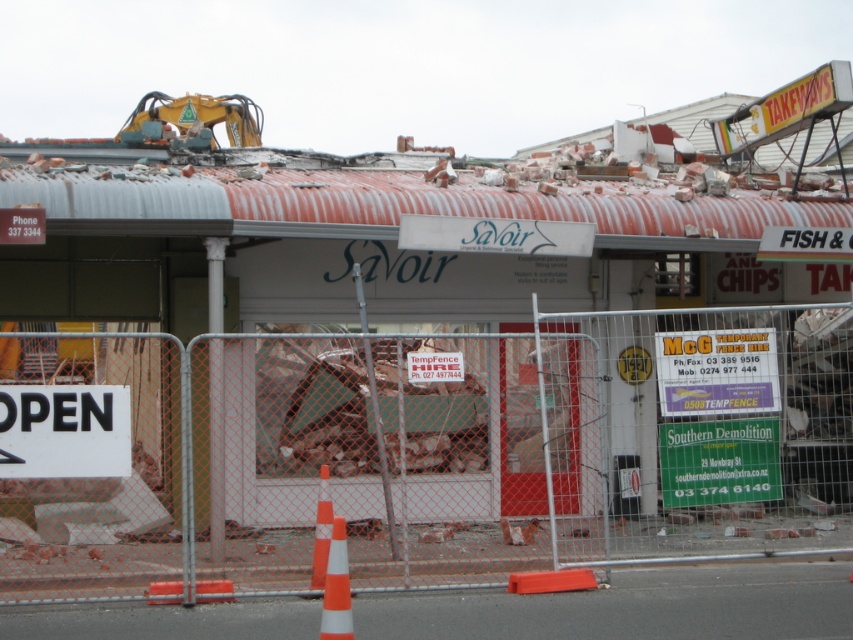
You are a delivery driver who needs to call the client using the red plastic phone at upper left. You see the orange and white striped traffic cone at center blocking your path. Can you walk around the cone to reach the phone?

The orange and white striped traffic cone at center is closer to the viewer than the red plastic phone at upper left, so you can walk around the cone to reach the phone since it is in front of you.